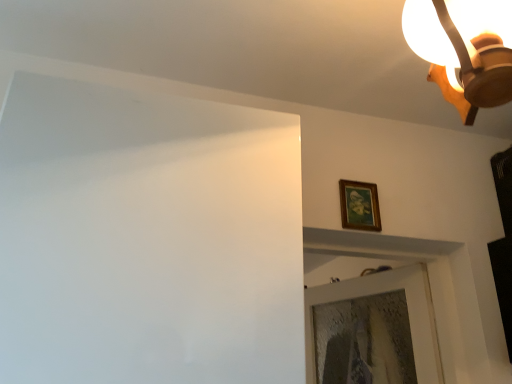
In order to click on wooden ceiling light at upper right in this screenshot , I will do `click(464, 49)`.

The height and width of the screenshot is (384, 512). Describe the element at coordinates (464, 49) in the screenshot. I see `wooden ceiling light at upper right` at that location.

Measure the distance between point (x=343, y=194) and camera.

The distance of point (x=343, y=194) from camera is 1.68 meters.

Image resolution: width=512 pixels, height=384 pixels. What do you see at coordinates (359, 205) in the screenshot?
I see `wooden framed painting at upper right` at bounding box center [359, 205].

Identify the location of wooden framed painting at upper right. This screenshot has height=384, width=512. (359, 205).

At what (x,y) coordinates should I click in order to perform the action: click on wooden ceiling light at upper right. Please return your answer as a coordinate pair (x, y). The image size is (512, 384). Looking at the image, I should click on (464, 49).

Which object is positioned more to the left, wooden ceiling light at upper right or wooden framed painting at upper right?

wooden framed painting at upper right is more to the left.

Is wooden ceiling light at upper right positioned in front of wooden framed painting at upper right?

Yes, wooden ceiling light at upper right is in front of wooden framed painting at upper right.

Does point (478, 13) appear closer or farther from the camera than point (353, 208)?

Point (478, 13) is closer to the camera than point (353, 208).

From the image's perspective, is wooden ceiling light at upper right above wooden framed painting at upper right?

Yes.

From a real-world perspective, is wooden ceiling light at upper right positioned over wooden framed painting at upper right based on gravity?

Yes.

Considering the relative sizes of wooden ceiling light at upper right and wooden framed painting at upper right in the image provided, is wooden ceiling light at upper right thinner than wooden framed painting at upper right?

Incorrect, the width of wooden ceiling light at upper right is not less than that of wooden framed painting at upper right.

Considering the relative sizes of wooden ceiling light at upper right and wooden framed painting at upper right in the image provided, is wooden ceiling light at upper right taller than wooden framed painting at upper right?

Yes, wooden ceiling light at upper right is taller than wooden framed painting at upper right.

Based on their sizes in the image, would you say wooden ceiling light at upper right is bigger or smaller than wooden framed painting at upper right?

wooden ceiling light at upper right is bigger than wooden framed painting at upper right.

Is wooden ceiling light at upper right not within wooden framed painting at upper right?

Indeed, wooden ceiling light at upper right is completely outside wooden framed painting at upper right.

Is wooden ceiling light at upper right not close to wooden framed painting at upper right?

Actually, wooden ceiling light at upper right and wooden framed painting at upper right are a little close together.

Is wooden ceiling light at upper right facing towards wooden framed painting at upper right?

Yes.

How many degrees apart are the facing directions of wooden ceiling light at upper right and wooden framed painting at upper right?

wooden ceiling light at upper right and wooden framed painting at upper right are facing 180 degrees away from each other.

Measure the distance between wooden ceiling light at upper right and wooden framed painting at upper right.

The distance of wooden ceiling light at upper right from wooden framed painting at upper right is 84.70 centimeters.

You are a GUI agent. You are given a task and a screenshot of the screen. Output one action in this format:
    pyautogui.click(x=<x>, y=<y>)
    Task: Click on the picture frame on the left side of wooden ceiling light at upper right
    This screenshot has width=512, height=384.
    Given the screenshot: What is the action you would take?
    pyautogui.click(x=359, y=205)

Considering the relative positions of wooden framed painting at upper right and wooden ceiling light at upper right in the image provided, is wooden framed painting at upper right to the left or to the right of wooden ceiling light at upper right?

Based on their positions, wooden framed painting at upper right is located to the left of wooden ceiling light at upper right.

Is wooden framed painting at upper right positioned behind wooden ceiling light at upper right?

That is True.

Which is closer to the camera, (362, 193) or (482, 98)?

The point (482, 98) is closer.

From the image's perspective, which one is positioned higher, wooden framed painting at upper right or wooden ceiling light at upper right?

wooden ceiling light at upper right appears higher in the image.

Based on the photo, from a real-world perspective, is wooden framed painting at upper right physically above wooden ceiling light at upper right?

No, from a real-world perspective, wooden framed painting at upper right is not above wooden ceiling light at upper right.

Which of these two, wooden framed painting at upper right or wooden ceiling light at upper right, is thinner?

wooden framed painting at upper right is thinner.

Can you confirm if wooden framed painting at upper right is shorter than wooden ceiling light at upper right?

Yes, wooden framed painting at upper right is shorter than wooden ceiling light at upper right.

Looking at the image, does wooden framed painting at upper right seem bigger or smaller compared to wooden ceiling light at upper right?

In the image, wooden framed painting at upper right appears to be smaller than wooden ceiling light at upper right.

Is wooden framed painting at upper right outside of wooden ceiling light at upper right?

That's correct, wooden framed painting at upper right is outside of wooden ceiling light at upper right.

Are wooden framed painting at upper right and wooden ceiling light at upper right far apart?

No, there isn't a large distance between wooden framed painting at upper right and wooden ceiling light at upper right.

In the scene shown: Is wooden framed painting at upper right positioned with its back to wooden ceiling light at upper right?

wooden framed painting at upper right is not turned away from wooden ceiling light at upper right.

How many degrees apart are the facing directions of wooden framed painting at upper right and wooden ceiling light at upper right?

wooden framed painting at upper right and wooden ceiling light at upper right are facing 180 degrees away from each other.

How distant is wooden framed painting at upper right from wooden ceiling light at upper right?

wooden framed painting at upper right and wooden ceiling light at upper right are 33.35 inches apart.

This screenshot has width=512, height=384. In order to click on lamp to the right of wooden framed painting at upper right in this screenshot , I will do `click(464, 49)`.

The image size is (512, 384). In the image, there is a wooden framed painting at upper right. Find the location of `lamp above it (from the image's perspective)`. lamp above it (from the image's perspective) is located at coordinates (464, 49).

What are the coordinates of `lamp in front of the wooden framed painting at upper right` in the screenshot? It's located at tap(464, 49).